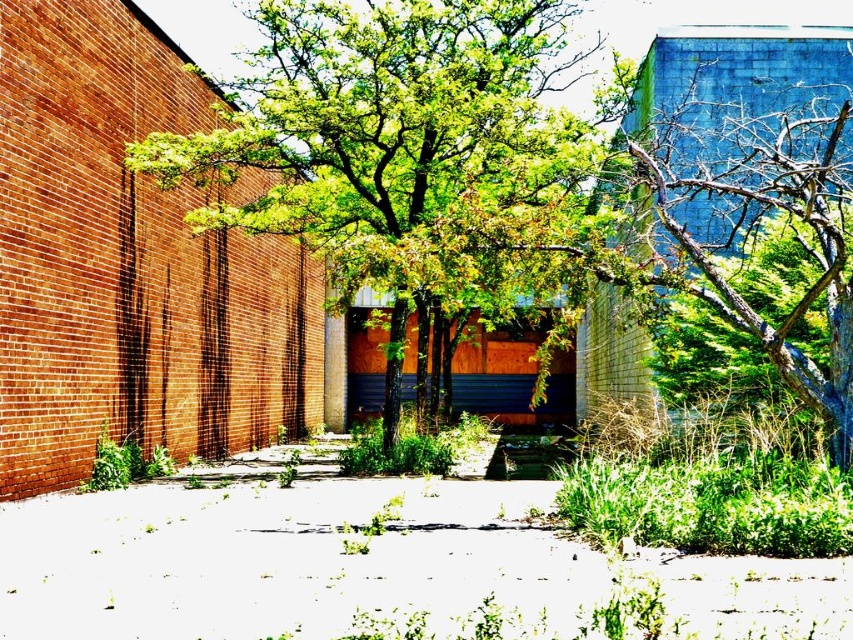
Can you confirm if green leafy tree at center is bigger than white gravel at center?

Yes.

In the scene shown: Is green leafy tree at center shorter than white gravel at center?

Incorrect, green leafy tree at center's height does not fall short of white gravel at center's.

Locate an element on the screen. Image resolution: width=853 pixels, height=640 pixels. green leafy tree at center is located at coordinates (408, 150).